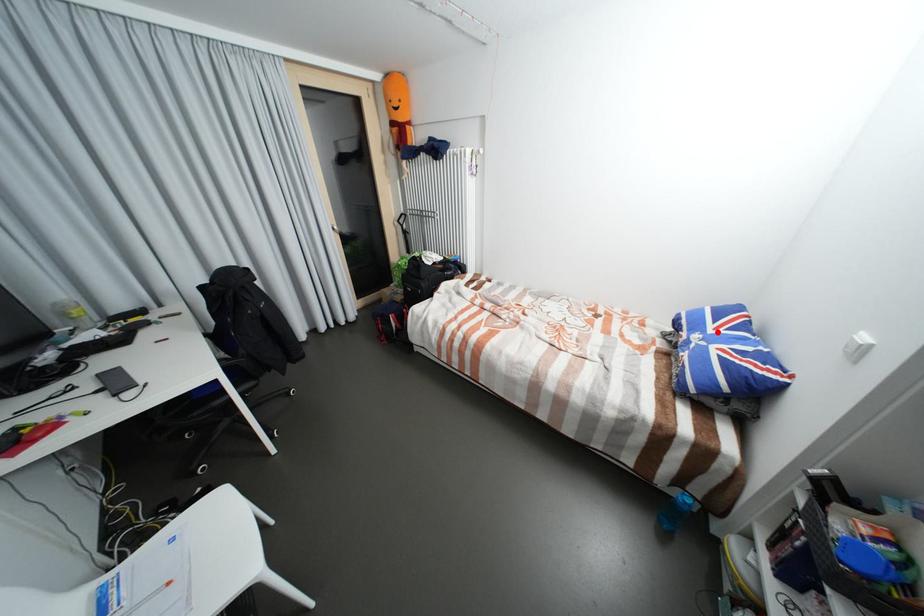
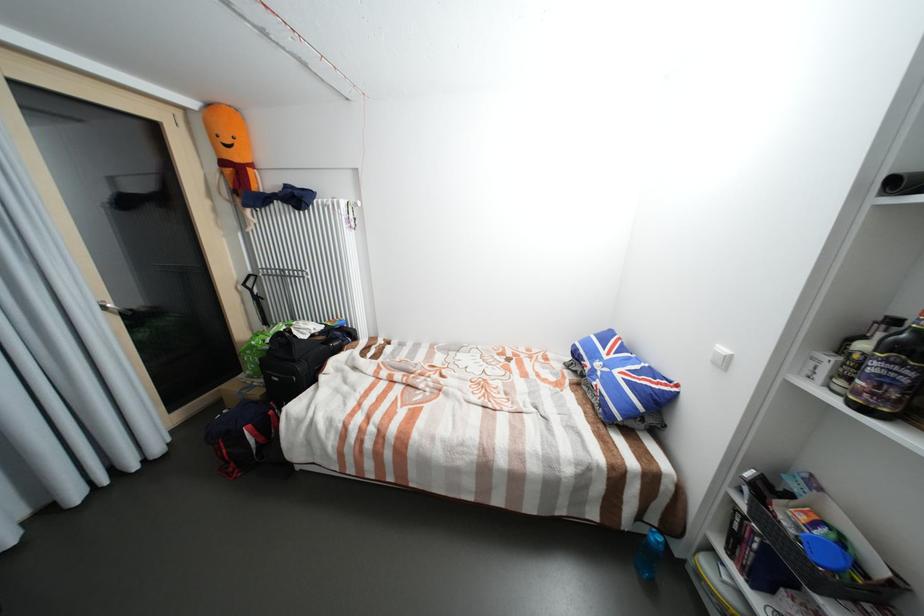
Find the pixel in the second image that matches the highlighted location in the first image.

(613, 358)